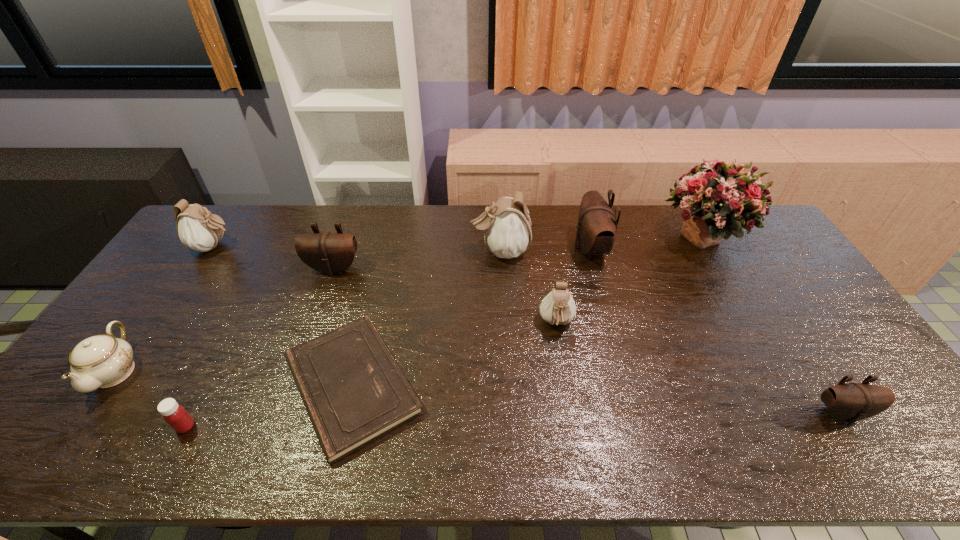
At what (x,y) coordinates should I click in order to perform the action: click on the fifth farthest pouch. Please return your answer as a coordinate pair (x, y). Looking at the image, I should click on (558, 307).

In order to click on chinaware in this screenshot , I will do `click(101, 361)`.

At what (x,y) coordinates should I click in order to perform the action: click on the nearest pouch. Please return your answer as a coordinate pair (x, y). This screenshot has height=540, width=960. Looking at the image, I should click on (851, 402).

Where is `the nearest brown pouch`? Image resolution: width=960 pixels, height=540 pixels. the nearest brown pouch is located at coordinates (851, 402).

Image resolution: width=960 pixels, height=540 pixels. What are the coordinates of `red medicine` in the screenshot? It's located at (175, 415).

Where is `the third object from left to right`? This screenshot has width=960, height=540. the third object from left to right is located at coordinates (175, 415).

The width and height of the screenshot is (960, 540). What are the coordinates of `paperback book` in the screenshot? It's located at (354, 392).

Identify the location of vacant space positioned on the front of the pink bouquet. This screenshot has width=960, height=540. (735, 292).

Find the location of a particular element. Image resolution: width=960 pixels, height=540 pixels. blank space located 0.210m on the front-facing side of the biggest white pouch is located at coordinates (409, 251).

Where is `free location located on the front-facing side of the biggest white pouch`? free location located on the front-facing side of the biggest white pouch is located at coordinates (389, 251).